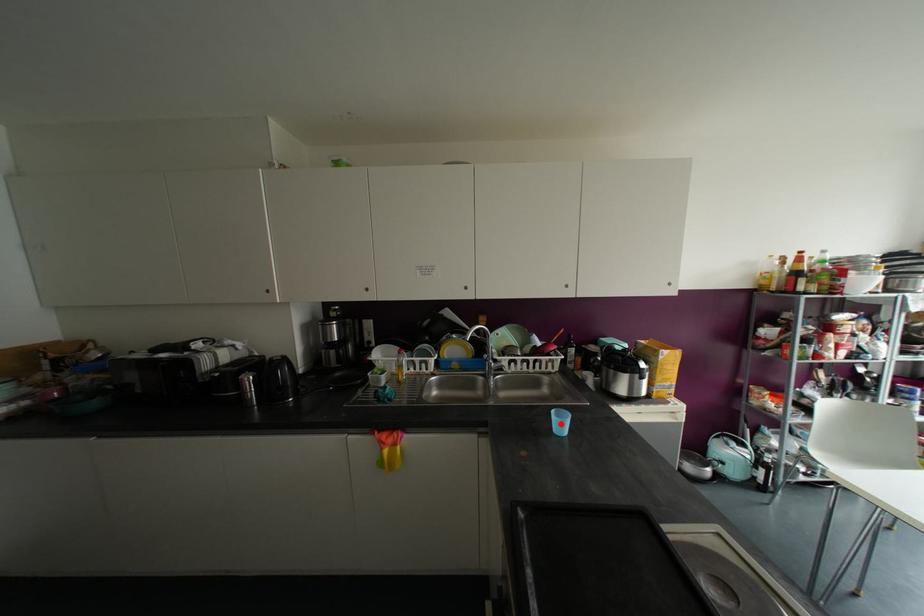
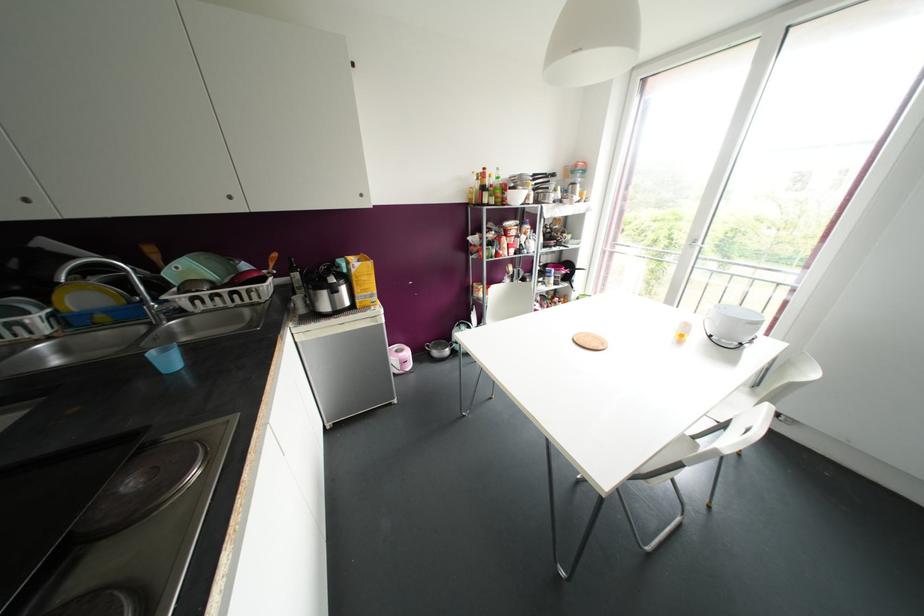
The point at the highlighted location is marked in the first image. Where is the corresponding point in the second image?

(168, 361)